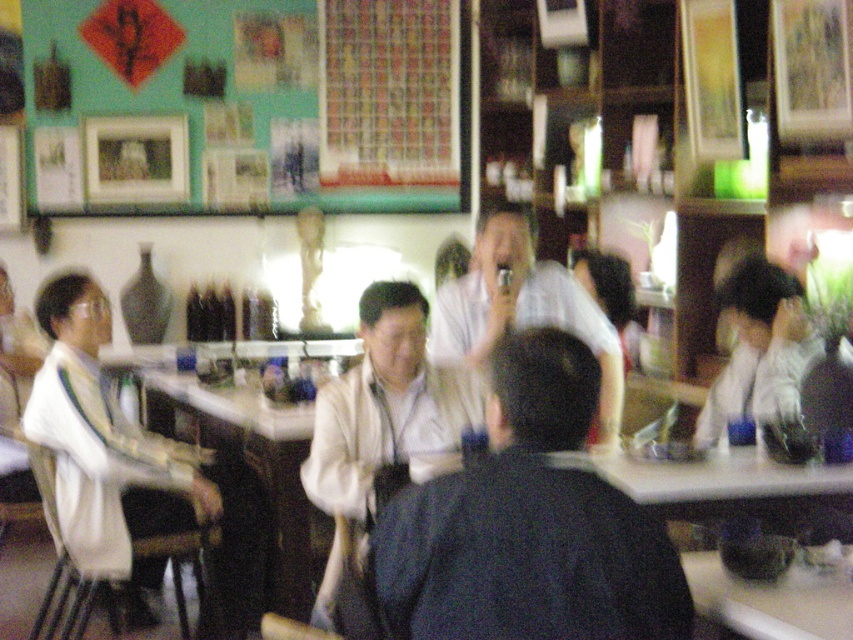
You are a photographer trying to capture a clear shot of the white glossy shirt at center and the white glossy table at lower right. Since both are white and glossy, you need to adjust your camera settings to avoid overexposure. Which object should you adjust the exposure for first to ensure both are properly captured?

The white glossy shirt at center has a larger size compared to the white glossy table at lower right, so you should adjust the exposure for the white glossy shirt at center first to prevent it from overexposing due to its larger area.

You are a delivery person carrying a package that is 3 feet wide. You need to move from the entrance to the back counter, which is behind the white matte shirt at left and white matte jacket at center. Can you pass between them without tilting the package?

The distance between the white matte shirt at left and white matte jacket at center is 34.29 inches. Since the package is 3 feet wide, which is 36 inches, it is slightly wider than the available space. Therefore, you cannot pass between them without tilting the package.